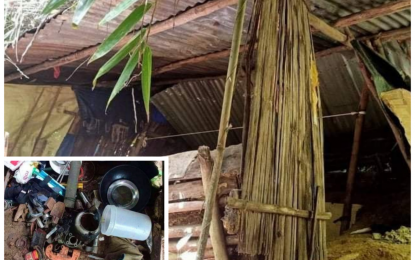
Image resolution: width=415 pixels, height=260 pixels. Find the location of `ceiling`. ceiling is located at coordinates (187, 47), (202, 99).